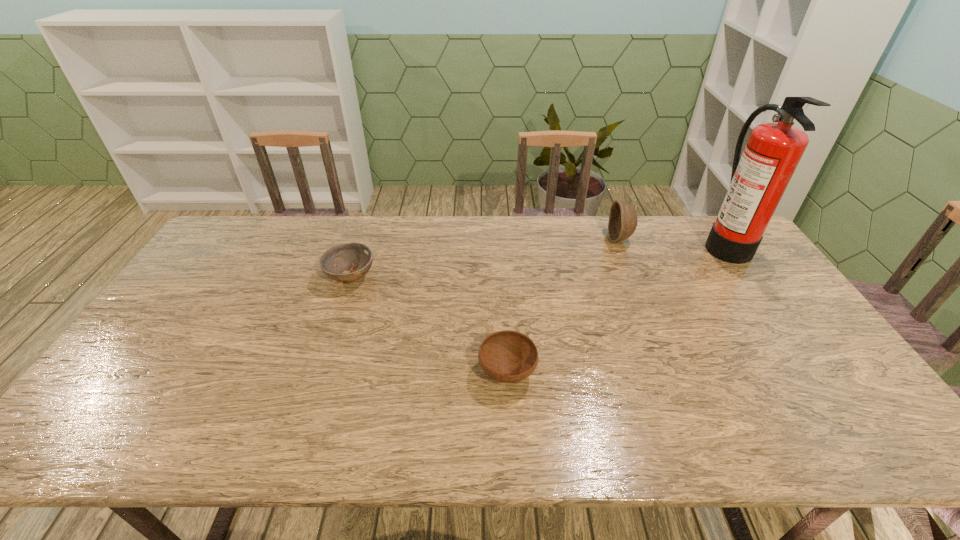
Image resolution: width=960 pixels, height=540 pixels. What are the coordinates of `fire extinguisher` in the screenshot? It's located at (759, 179).

This screenshot has width=960, height=540. I want to click on the tallest object, so [759, 179].

The width and height of the screenshot is (960, 540). I want to click on the second tallest object, so click(623, 219).

This screenshot has width=960, height=540. Identify the location of the third object from left to right. (623, 219).

The width and height of the screenshot is (960, 540). I want to click on the leftmost object, so click(x=356, y=257).

At what (x,y) coordinates should I click in order to perform the action: click on the leftmost bowl. Please return your answer as a coordinate pair (x, y). Looking at the image, I should click on (356, 257).

Where is `the second bowl from right to left`? This screenshot has height=540, width=960. the second bowl from right to left is located at coordinates (506, 356).

This screenshot has width=960, height=540. In order to click on the nearest object in this screenshot , I will do `click(506, 356)`.

Identify the location of vacant space situated 0.100m on the front-facing side of the fire extinguisher. This screenshot has width=960, height=540. (674, 244).

This screenshot has height=540, width=960. Find the location of `vacant area located on the front-facing side of the fire extinguisher`. vacant area located on the front-facing side of the fire extinguisher is located at coordinates (622, 244).